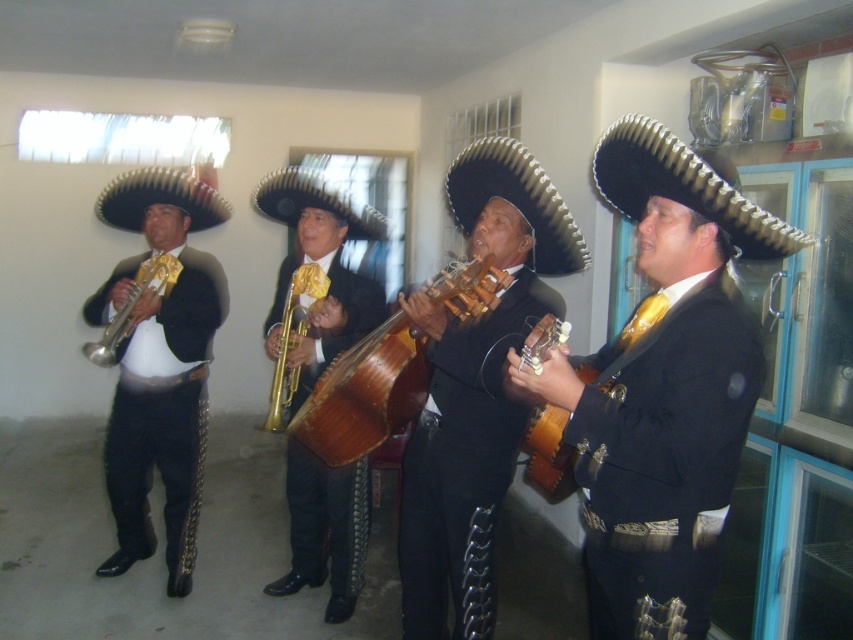
You are a photographer standing in front of the musicians. You want to take a closeup shot of the shiny black guitar at center. Where exactly should you aim your camera to capture it?

You should aim your camera at point (659, 388) to capture the shiny black guitar at center.

You are a photographer setting up for a mariachi performance. You need to ensure the shiny black mariachi hat at center and the matte black trumpet at left are both visible in your shot. Given their sizes, which object might require more space in the frame to avoid being cut off?

The matte black trumpet at left requires more space in the frame since its width is greater than the shiny black mariachi hat at center.

You are a stagehand setting up a narrow stage. You need to place both the shiny black guitar at center and the shiny black mariachi hat at center on the stage. The stage has a width limit of 1 meter. Can both items fit side by side without overlapping?

The shiny black guitar at center might be wider than the shiny black mariachi hat at center, so there is uncertainty if they can fit side by side within the 1 meter width limit. Check their combined width first.